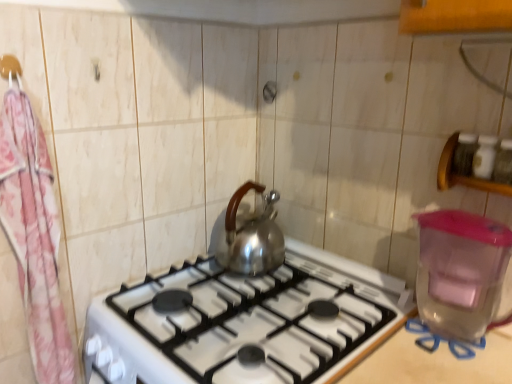
Question: Is satin silver gas stove at center beside pink floral fabric at left?

Choices:
 (A) yes
 (B) no

Answer: (B)

Question: Would you consider satin silver gas stove at center to be distant from pink floral fabric at left?

Choices:
 (A) yes
 (B) no

Answer: (B)

Question: Is satin silver gas stove at center positioned before pink floral fabric at left?

Choices:
 (A) yes
 (B) no

Answer: (A)

Question: Can you confirm if satin silver gas stove at center is smaller than pink floral fabric at left?

Choices:
 (A) no
 (B) yes

Answer: (A)

Question: From a real-world perspective, is satin silver gas stove at center located beneath pink floral fabric at left?

Choices:
 (A) yes
 (B) no

Answer: (A)

Question: Considering the positions of point (307, 329) and point (32, 177), is point (307, 329) closer or farther from the camera than point (32, 177)?

Choices:
 (A) closer
 (B) farther

Answer: (B)

Question: In the image, is satin silver gas stove at center on the left side or the right side of pink floral fabric at left?

Choices:
 (A) right
 (B) left

Answer: (A)

Question: Considering the positions of satin silver gas stove at center and pink floral fabric at left in the image, is satin silver gas stove at center taller or shorter than pink floral fabric at left?

Choices:
 (A) short
 (B) tall

Answer: (A)

Question: Is satin silver gas stove at center inside the boundaries of pink floral fabric at left, or outside?

Choices:
 (A) inside
 (B) outside

Answer: (B)

Question: From their relative heights in the image, would you say transparent plastic water heater at right is taller or shorter than pink fabric hanger at upper left?

Choices:
 (A) short
 (B) tall

Answer: (B)

Question: From the image's perspective, is transparent plastic water heater at right positioned above or below pink fabric hanger at upper left?

Choices:
 (A) below
 (B) above

Answer: (A)

Question: Looking at the image, does transparent plastic water heater at right seem bigger or smaller compared to pink fabric hanger at upper left?

Choices:
 (A) small
 (B) big

Answer: (B)

Question: From a real-world perspective, relative to pink fabric hanger at upper left, is transparent plastic water heater at right vertically above or below?

Choices:
 (A) above
 (B) below

Answer: (B)

Question: Considering the positions of point click(50, 182) and point click(12, 72), is point click(50, 182) closer or farther from the camera than point click(12, 72)?

Choices:
 (A) farther
 (B) closer

Answer: (A)

Question: Visually, is pink floral fabric at left positioned to the left or to the right of pink fabric hanger at upper left?

Choices:
 (A) right
 (B) left

Answer: (A)